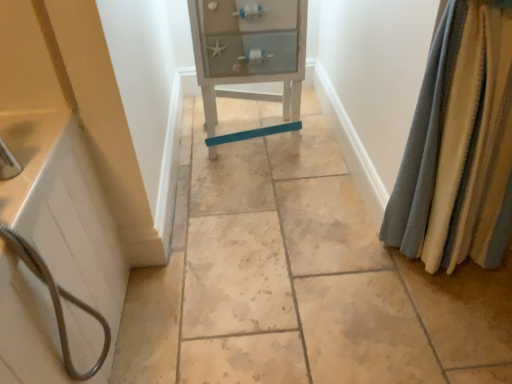
Question: From a real-world perspective, is white wood cabinet at center below white matte bathtub at left?

Choices:
 (A) yes
 (B) no

Answer: (A)

Question: Is white wood cabinet at center next to white matte bathtub at left and touching it?

Choices:
 (A) yes
 (B) no

Answer: (B)

Question: From the image's perspective, is white wood cabinet at center over white matte bathtub at left?

Choices:
 (A) yes
 (B) no

Answer: (A)

Question: Considering the relative sizes of white wood cabinet at center and white matte bathtub at left in the image provided, is white wood cabinet at center smaller than white matte bathtub at left?

Choices:
 (A) yes
 (B) no

Answer: (B)

Question: Considering the relative sizes of white wood cabinet at center and white matte bathtub at left in the image provided, is white wood cabinet at center thinner than white matte bathtub at left?

Choices:
 (A) yes
 (B) no

Answer: (B)

Question: Could white matte bathtub at left be considered to be inside white wood cabinet at center?

Choices:
 (A) yes
 (B) no

Answer: (B)

Question: Is white wood cabinet at center at the back of white matte bathtub at left?

Choices:
 (A) yes
 (B) no

Answer: (B)

Question: Is white matte bathtub at left aimed at white wood cabinet at center?

Choices:
 (A) yes
 (B) no

Answer: (B)

Question: Considering the relative sizes of white matte bathtub at left and white wood cabinet at center in the image provided, is white matte bathtub at left bigger than white wood cabinet at center?

Choices:
 (A) yes
 (B) no

Answer: (B)

Question: From the image's perspective, is white matte bathtub at left located above white wood cabinet at center?

Choices:
 (A) yes
 (B) no

Answer: (B)

Question: Would you say white matte bathtub at left contains white wood cabinet at center?

Choices:
 (A) no
 (B) yes

Answer: (A)

Question: Is white matte bathtub at left behind white wood cabinet at center?

Choices:
 (A) yes
 (B) no

Answer: (B)

Question: Does white wood cabinet at center have a lesser width compared to velvet-like beige curtains at right?

Choices:
 (A) yes
 (B) no

Answer: (B)